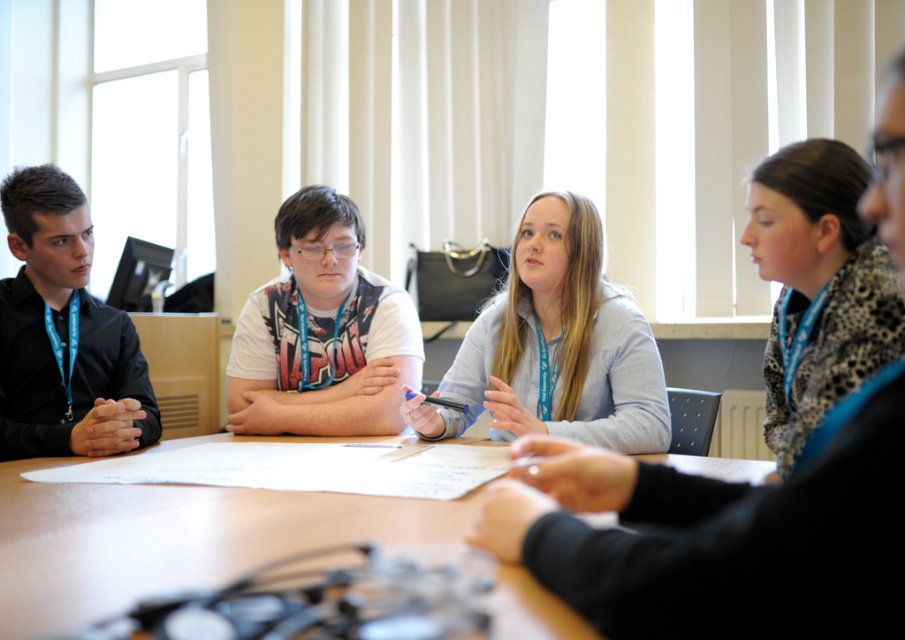
Is wooden table at center taller than light blue shirt at center?

No.

Which is below, wooden table at center or light blue shirt at center?

wooden table at center is below.

This screenshot has width=905, height=640. Find the location of `wooden table at center`. wooden table at center is located at coordinates (175, 538).

The width and height of the screenshot is (905, 640). In order to click on wooden table at center in this screenshot , I will do `click(175, 538)`.

Is point (8, 608) less distant than point (312, 305)?

Yes, point (8, 608) is in front of point (312, 305).

Which is above, wooden table at center or white matte shirt at center?

white matte shirt at center is higher up.

Between point (418, 506) and point (393, 404), which one is positioned behind?

Positioned behind is point (393, 404).

Locate an element on the screen. The image size is (905, 640). wooden table at center is located at coordinates (175, 538).

Measure the distance between light blue shirt at center and white matte shirt at center.

A distance of 37.81 centimeters exists between light blue shirt at center and white matte shirt at center.

Find the location of a particular element. Image resolution: width=905 pixels, height=640 pixels. light blue shirt at center is located at coordinates (555, 346).

I want to click on light blue shirt at center, so click(x=555, y=346).